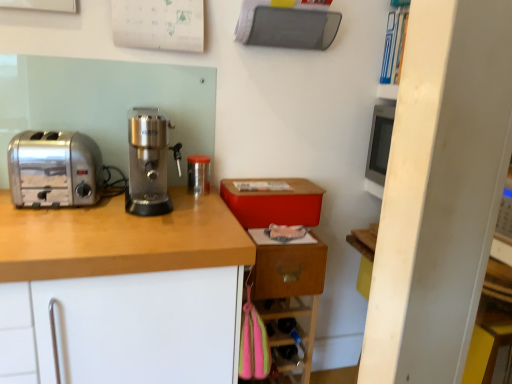
Image resolution: width=512 pixels, height=384 pixels. Describe the element at coordinates (54, 169) in the screenshot. I see `satin silver toaster at left` at that location.

In order to click on transparent plastic container at center in this screenshot , I will do `click(198, 174)`.

Where is `wooden drawer at lower right`? The image size is (512, 384). wooden drawer at lower right is located at coordinates (288, 270).

Locate an element on the screen. wooden at left is located at coordinates (119, 239).

The width and height of the screenshot is (512, 384). Find the location of `satin silver coffee grinder at center`. satin silver coffee grinder at center is located at coordinates (149, 162).

Which is correct: wooden at left is inside wooden drawer at lower right, or outside of it?

wooden at left is not inside wooden drawer at lower right, it's outside.

From the image's perspective, is wooden at left over wooden drawer at lower right?

Actually, wooden at left appears below wooden drawer at lower right in the image.

Can you see wooden at left touching wooden drawer at lower right?

No, wooden at left is not in contact with wooden drawer at lower right.

Is wooden at left facing towards wooden drawer at lower right?

No, wooden at left does not turn towards wooden drawer at lower right.

Do you think wooden at left is within transparent plastic container at center, or outside of it?

wooden at left is not enclosed by transparent plastic container at center.

From the image's perspective, which is above, wooden at left or transparent plastic container at center?

transparent plastic container at center, from the image's perspective.

Are wooden at left and satin silver toaster at left located far from each other?

That's not correct — wooden at left is a little close to satin silver toaster at left.

Is point (96, 220) farther from viewer compared to point (41, 205)?

No, (96, 220) is in front of (41, 205).

Is wooden at left smaller than satin silver toaster at left?

No.

Is wooden at left at the left side of satin silver toaster at left?

In fact, wooden at left is to the right of satin silver toaster at left.

Looking at this image, considering their positions, is satin silver coffee grinder at center located in front of or behind satin silver toaster at left?

satin silver coffee grinder at center is in front of satin silver toaster at left.

Is satin silver coffee grinder at center not inside satin silver toaster at left?

Yes, satin silver coffee grinder at center is not within satin silver toaster at left.

Consider the image. Is satin silver coffee grinder at center next to satin silver toaster at left?

No, satin silver coffee grinder at center is not next to satin silver toaster at left.

Is satin silver toaster at left with satin silver coffee grinder at center?

No, satin silver toaster at left is not making contact with satin silver coffee grinder at center.

Which is behind, satin silver toaster at left or satin silver coffee grinder at center?

satin silver toaster at left.

From a real-world perspective, is satin silver toaster at left positioned under satin silver coffee grinder at center based on gravity?

Yes, from a real-world perspective, satin silver toaster at left is below satin silver coffee grinder at center.

Would you say satin silver toaster at left is to the left or to the right of satin silver coffee grinder at center in the picture?

Clearly, satin silver toaster at left is on the left of satin silver coffee grinder at center in the image.

From the image's perspective, relative to satin silver coffee grinder at center, is wooden drawer at lower right above or below?

Based on their image positions, wooden drawer at lower right is located beneath satin silver coffee grinder at center.

Between point (272, 269) and point (141, 124), which one is positioned behind?

The point (272, 269) is behind.

Is wooden drawer at lower right next to satin silver coffee grinder at center?

No, wooden drawer at lower right is not touching satin silver coffee grinder at center.

Identify the location of drawer that appears below the satin silver coffee grinder at center (from a real-world perspective). (288, 270).

Which is in front, wooden drawer at lower right or transparent plastic container at center?

wooden drawer at lower right.

From the image's perspective, is wooden drawer at lower right under transparent plastic container at center?

Yes, from the image's perspective, wooden drawer at lower right is below transparent plastic container at center.

In the scene shown: Which is farther from the camera, [281,257] or [205,193]?

The point [205,193] is farther from the camera.

Find the location of `cabinetry below the wooden drawer at lower right (from a real-world perspective)`. cabinetry below the wooden drawer at lower right (from a real-world perspective) is located at coordinates (119, 239).

Identify the location of kitchen appliance above the wooden at left (from a real-world perspective). The width and height of the screenshot is (512, 384). (198, 174).

From the image, which object appears to be nearer to satin silver toaster at left, satin silver coffee grinder at center or wooden drawer at lower right?

satin silver coffee grinder at center is closer to satin silver toaster at left.

From the image, which object appears to be farther from wooden at left, transparent plastic container at center or wooden drawer at lower right?

transparent plastic container at center is positioned further to the anchor wooden at left.

Which object lies further to the anchor point wooden drawer at lower right, satin silver coffee grinder at center or satin silver toaster at left?

satin silver toaster at left is further to wooden drawer at lower right.

Which object lies nearer to the anchor point satin silver coffee grinder at center, wooden drawer at lower right or wooden at left?

Among the two, wooden at left is located nearer to satin silver coffee grinder at center.

From the picture: From the image, which object appears to be farther from satin silver coffee grinder at center, transparent plastic container at center or wooden drawer at lower right?

The object further to satin silver coffee grinder at center is wooden drawer at lower right.

When comparing their distances from transparent plastic container at center, does satin silver coffee grinder at center or satin silver toaster at left seem closer?

Based on the image, satin silver coffee grinder at center appears to be nearer to transparent plastic container at center.

Looking at the image, which one is located closer to wooden drawer at lower right, wooden at left or transparent plastic container at center?

The object closer to wooden drawer at lower right is wooden at left.

From the image, which object appears to be nearer to transparent plastic container at center, wooden at left or wooden drawer at lower right?

wooden drawer at lower right is closer to transparent plastic container at center.

Find the location of a particular element. kitchen appliance between satin silver toaster at left and wooden drawer at lower right from left to right is located at coordinates (198, 174).

Identify the location of home appliance between satin silver toaster at left and transparent plastic container at center from left to right. This screenshot has width=512, height=384. [x=149, y=162].

At what (x,y) coordinates should I click in order to perform the action: click on kitchen appliance between satin silver coffee grinder at center and wooden drawer at lower right in the horizontal direction. Please return your answer as a coordinate pair (x, y). The width and height of the screenshot is (512, 384). Looking at the image, I should click on (198, 174).

At what (x,y) coordinates should I click in order to perform the action: click on kitchen appliance that lies between satin silver coffee grinder at center and wooden at left from top to bottom. Please return your answer as a coordinate pair (x, y). This screenshot has width=512, height=384. Looking at the image, I should click on (198, 174).